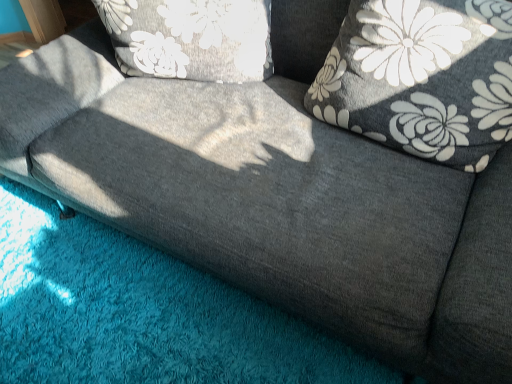
What do you see at coordinates (422, 78) in the screenshot?
I see `fluffy gray pillow at upper right` at bounding box center [422, 78].

The height and width of the screenshot is (384, 512). Identify the location of fluffy gray pillow at upper right. (422, 78).

This screenshot has height=384, width=512. I want to click on fluffy gray pillow at upper right, so click(x=422, y=78).